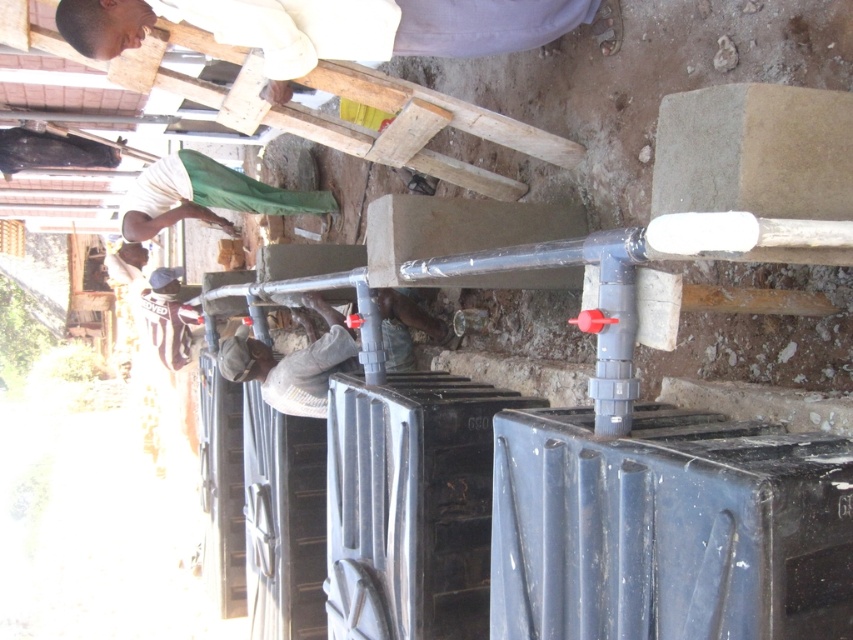
You are a safety inspector checking the construction site. You notice the light brown wooden plank at upper center and the white matte shirt at upper left. According to safety protocols, the plank must not be placed over any personnel. Is the current arrangement compliant with safety standards?

The light brown wooden plank at upper center is positioned over white matte shirt at upper left, which violates safety protocols. The plank should not be placed over any personnel, so the current arrangement is noncompliant.

You are a safety inspector and need to check the safety of the workers in the scene. Which worker is closer to you, the dark gray concrete man at center or the white matte shirt at upper left?

The dark gray concrete man at center is closer to you since he is in front of the white matte shirt at upper left.